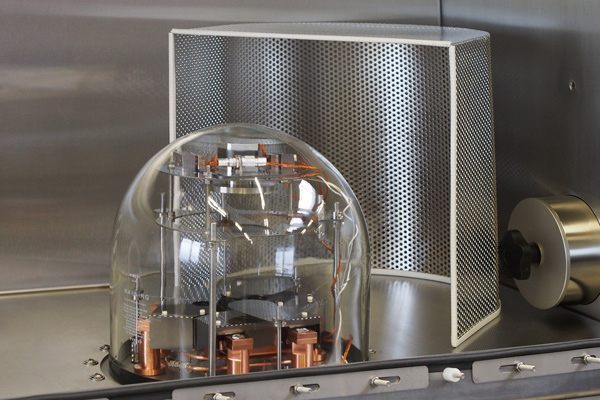
This screenshot has width=600, height=400. I want to click on black knob, so click(522, 254).